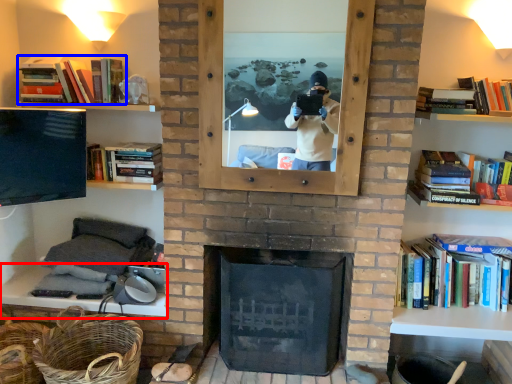
Question: Which object is further to the camera taking this photo, mantle (highlighted by a red box) or book (highlighted by a blue box)?

Choices:
 (A) mantle
 (B) book

Answer: (B)